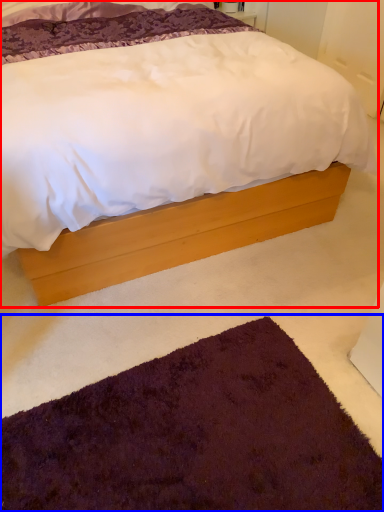
Question: Which object appears farthest to the camera in this image, bed (highlighted by a red box) or doormat (highlighted by a blue box)?

Choices:
 (A) bed
 (B) doormat

Answer: (B)